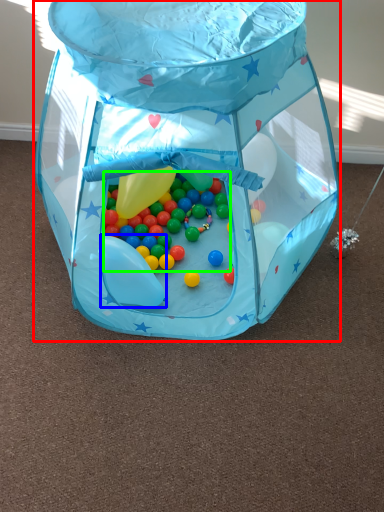
Question: Which object is the farthest from toy (highlighted by a red box)? Choose among these: balloon (highlighted by a blue box) or candy (highlighted by a green box).

Choices:
 (A) balloon
 (B) candy

Answer: (A)